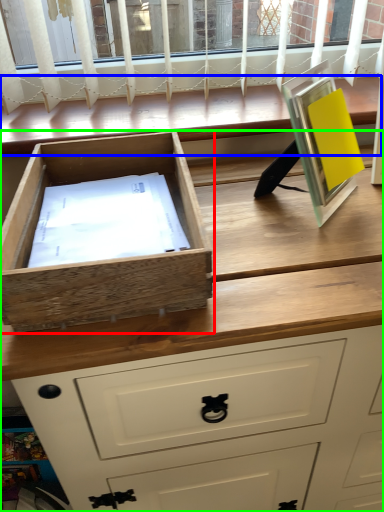
Question: Estimate the real-world distances between objects in this image. Which object is closer to drawer (highlighted by a red box), window (highlighted by a blue box) or chest of drawers (highlighted by a green box)?

Choices:
 (A) window
 (B) chest of drawers

Answer: (B)